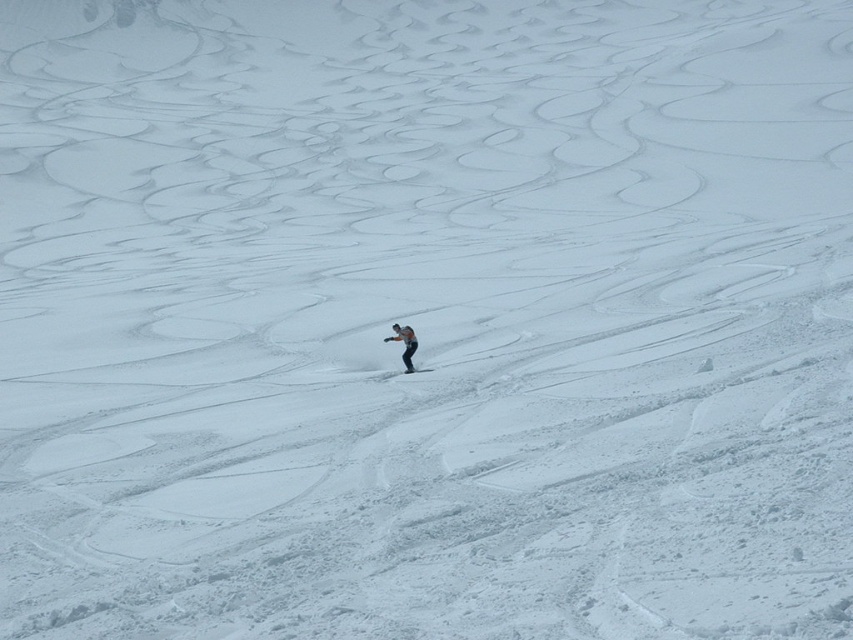
Question: Which object appears farthest from the camera in this image?

Choices:
 (A) black matte ski at center
 (B) gray fabric jacket at center

Answer: (B)

Question: Is gray fabric jacket at center to the left of black matte ski at center from the viewer's perspective?

Choices:
 (A) yes
 (B) no

Answer: (A)

Question: Is gray fabric jacket at center to the right of black matte ski at center from the viewer's perspective?

Choices:
 (A) no
 (B) yes

Answer: (A)

Question: Which object appears closest to the camera in this image?

Choices:
 (A) gray fabric jacket at center
 (B) black matte ski at center

Answer: (B)

Question: Does gray fabric jacket at center appear on the left side of black matte ski at center?

Choices:
 (A) no
 (B) yes

Answer: (B)